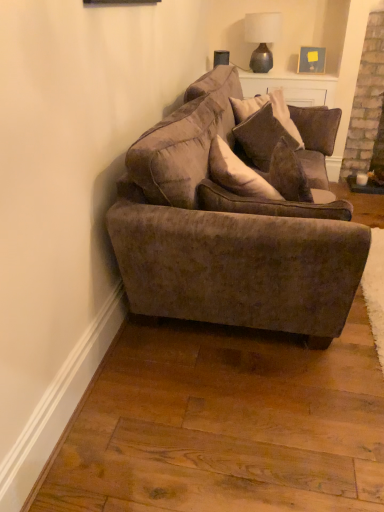
Question: From the image's perspective, is velvet brown pillow at center on matte gray glass lamp at upper center?

Choices:
 (A) yes
 (B) no

Answer: (B)

Question: Is velvet brown pillow at center smaller than matte gray glass lamp at upper center?

Choices:
 (A) no
 (B) yes

Answer: (B)

Question: Considering the relative sizes of velvet brown pillow at center and matte gray glass lamp at upper center in the image provided, is velvet brown pillow at center thinner than matte gray glass lamp at upper center?

Choices:
 (A) yes
 (B) no

Answer: (A)

Question: Is velvet brown pillow at center positioned before matte gray glass lamp at upper center?

Choices:
 (A) no
 (B) yes

Answer: (B)

Question: Considering the relative sizes of velvet brown pillow at center and matte gray glass lamp at upper center in the image provided, is velvet brown pillow at center bigger than matte gray glass lamp at upper center?

Choices:
 (A) no
 (B) yes

Answer: (A)

Question: Visually, is velvet brown pillow at center positioned to the left or to the right of matte gray glass lamp at upper center?

Choices:
 (A) left
 (B) right

Answer: (A)

Question: Considering their positions, is velvet brown pillow at center located in front of or behind matte gray glass lamp at upper center?

Choices:
 (A) front
 (B) behind

Answer: (A)

Question: Do you think velvet brown pillow at center is within matte gray glass lamp at upper center, or outside of it?

Choices:
 (A) inside
 (B) outside

Answer: (B)

Question: In terms of width, does velvet brown pillow at center look wider or thinner when compared to matte gray glass lamp at upper center?

Choices:
 (A) thin
 (B) wide

Answer: (A)

Question: In the image, is velvet brown couch at center positioned in front of or behind matte gray glass lamp at upper center?

Choices:
 (A) front
 (B) behind

Answer: (A)

Question: Considering the relative positions of velvet brown couch at center and matte gray glass lamp at upper center in the image provided, is velvet brown couch at center to the left or to the right of matte gray glass lamp at upper center?

Choices:
 (A) right
 (B) left

Answer: (B)

Question: Is velvet brown couch at center taller or shorter than matte gray glass lamp at upper center?

Choices:
 (A) tall
 (B) short

Answer: (A)

Question: From a real-world perspective, is velvet brown couch at center physically located above or below matte gray glass lamp at upper center?

Choices:
 (A) above
 (B) below

Answer: (B)

Question: Would you say matte gray glass lamp at upper center is to the left or to the right of velvet brown pillow at center in the picture?

Choices:
 (A) right
 (B) left

Answer: (A)

Question: In terms of height, does matte gray glass lamp at upper center look taller or shorter compared to velvet brown pillow at center?

Choices:
 (A) tall
 (B) short

Answer: (A)